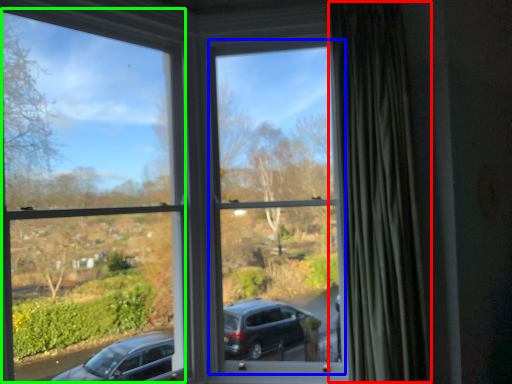
Question: Based on their relative distances, which object is nearer to curtain (highlighted by a red box)? Choose from window frame (highlighted by a blue box) and window frame (highlighted by a green box).

Choices:
 (A) window frame
 (B) window frame

Answer: (A)